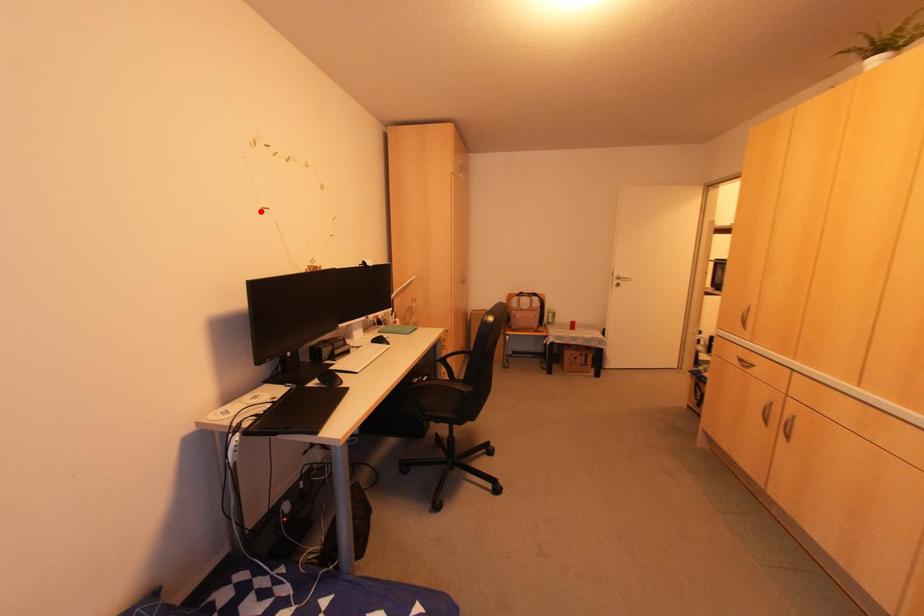
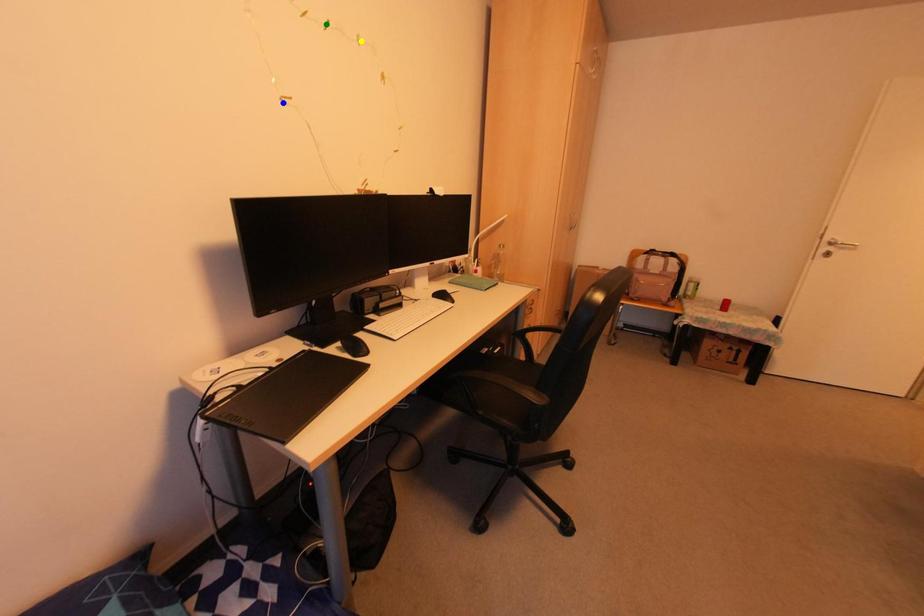
Question: I am providing you with two images of the same scene from different viewpoints. A red point is marked on the first image. You are given multiple points on the second image. Which point in image 2 represents the same 3d spot as the red point in image 1?

Choices:
 (A) blue point
 (B) yellow point
 (C) green point

Answer: (A)